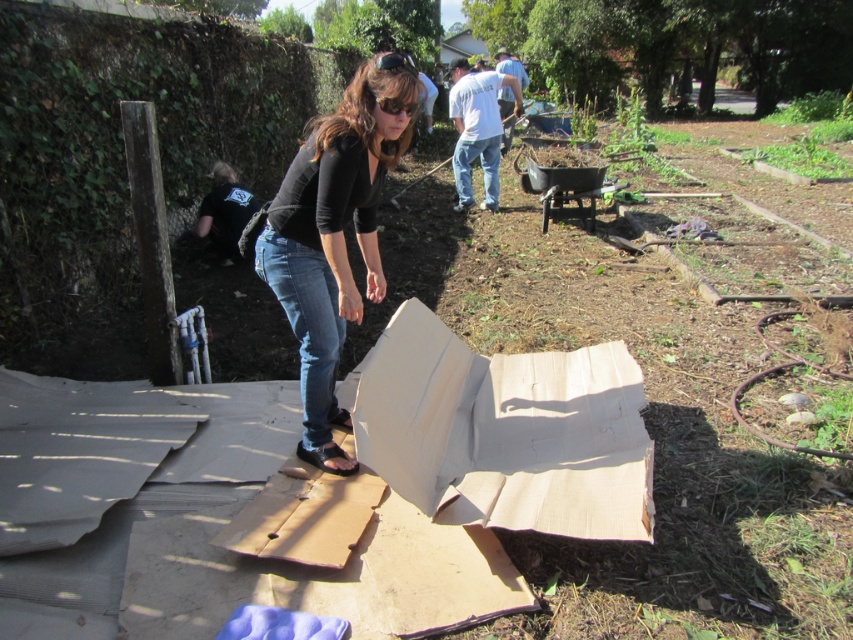
Question: Which point appears farthest from the camera in this image?

Choices:
 (A) (312, 241)
 (B) (508, 358)

Answer: (B)

Question: Does white cardboard box at center lie behind matte black shirt at center?

Choices:
 (A) no
 (B) yes

Answer: (A)

Question: Is white cardboard box at center above matte black shirt at center?

Choices:
 (A) yes
 (B) no

Answer: (B)

Question: Is white cardboard box at center below matte black shirt at center?

Choices:
 (A) no
 (B) yes

Answer: (B)

Question: Among these objects, which one is nearest to the camera?

Choices:
 (A) matte black shirt at center
 (B) white cardboard box at center

Answer: (B)

Question: Which point appears farthest from the camera in this image?

Choices:
 (A) (427, 476)
 (B) (393, 88)

Answer: (A)